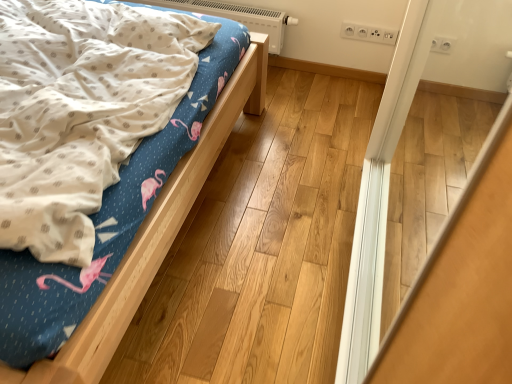
Question: Based on their positions, is white plastic heater at upper center located to the left or right of matte wood bed at left?

Choices:
 (A) right
 (B) left

Answer: (A)

Question: Based on their sizes in the image, would you say white plastic heater at upper center is bigger or smaller than matte wood bed at left?

Choices:
 (A) big
 (B) small

Answer: (B)

Question: Considering the positions of white plastic heater at upper center and matte wood bed at left in the image, is white plastic heater at upper center wider or thinner than matte wood bed at left?

Choices:
 (A) wide
 (B) thin

Answer: (B)

Question: Is matte wood bed at left spatially inside white plastic heater at upper center, or outside of it?

Choices:
 (A) outside
 (B) inside

Answer: (A)

Question: From a real-world perspective, is matte wood bed at left physically located above or below white plastic heater at upper center?

Choices:
 (A) below
 (B) above

Answer: (B)

Question: Considering the positions of matte wood bed at left and white plastic heater at upper center in the image, is matte wood bed at left wider or thinner than white plastic heater at upper center?

Choices:
 (A) wide
 (B) thin

Answer: (A)

Question: Considering their positions, is matte wood bed at left located in front of or behind white plastic heater at upper center?

Choices:
 (A) behind
 (B) front

Answer: (B)